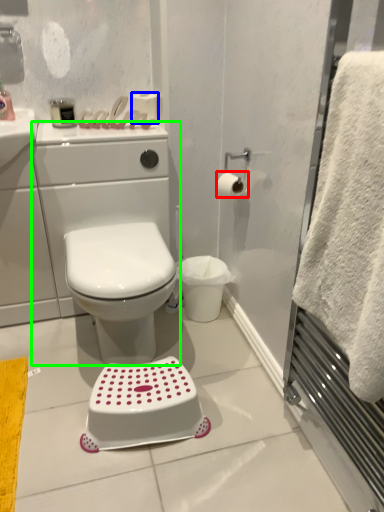
Question: Which object is positioned farthest from toilet paper (highlighted by a red box)? Select from toilet paper (highlighted by a blue box) and porcelain (highlighted by a green box).

Choices:
 (A) toilet paper
 (B) porcelain

Answer: (B)